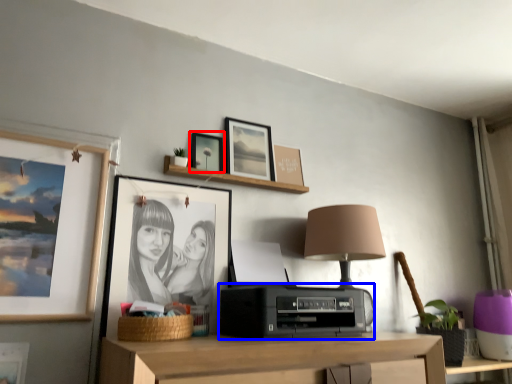
Question: Which object is closer to the camera taking this photo, picture frame (highlighted by a red box) or stereo (highlighted by a blue box)?

Choices:
 (A) picture frame
 (B) stereo

Answer: (B)